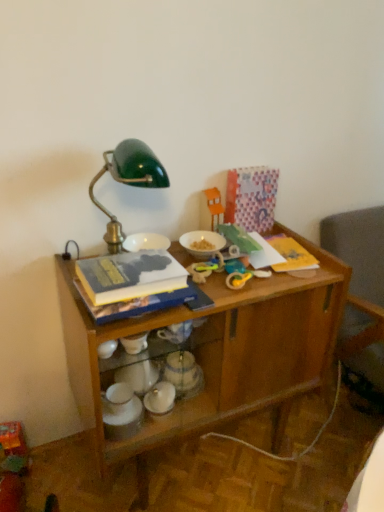
Identify the location of vacant area that is situated to the right of yellow rubber toy at center, which appears as the 1th toy when ordered from the bottom. This screenshot has width=384, height=512. (285, 279).